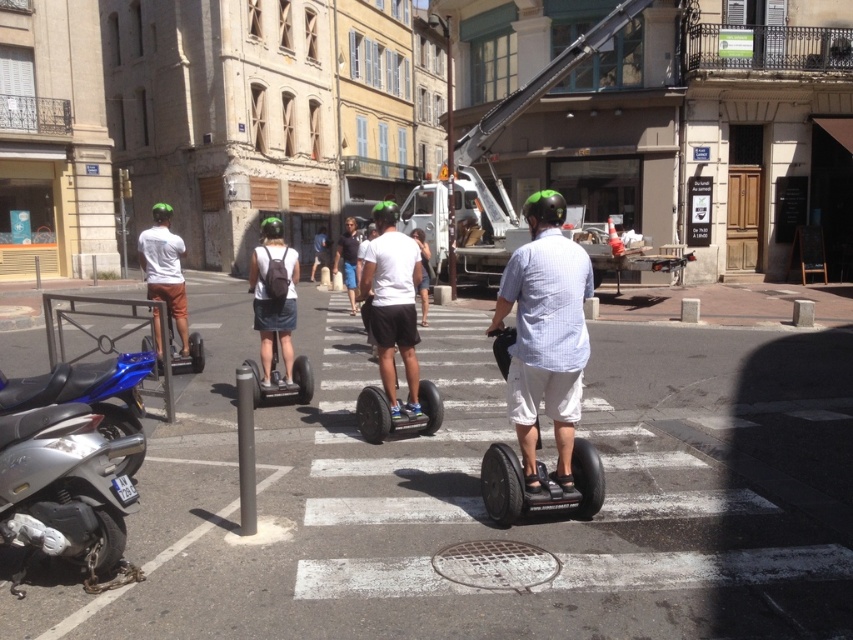
Question: Is white matte segway at center smaller than matte white shirt at left?

Choices:
 (A) yes
 (B) no

Answer: (A)

Question: Which point is farther from the camera taking this photo?

Choices:
 (A) (389, 413)
 (B) (317, 250)
 (C) (24, 518)
 (D) (258, 404)

Answer: (B)

Question: Which point is closer to the camera?

Choices:
 (A) black rubber scooter at center
 (B) white matte segway at center
 (C) dark blue shorts at center

Answer: (A)

Question: Can you confirm if black rubber segway at center is positioned to the right of white shirt at center?

Choices:
 (A) yes
 (B) no

Answer: (A)

Question: Which object is positioned closest to the white matte segway at center?

Choices:
 (A) dark blue backpack at center
 (B) black matte segway at center
 (C) dark blue shorts at center

Answer: (B)

Question: Can you confirm if light blue checkered shirt at center is positioned to the right of dark blue backpack at center?

Choices:
 (A) yes
 (B) no

Answer: (A)